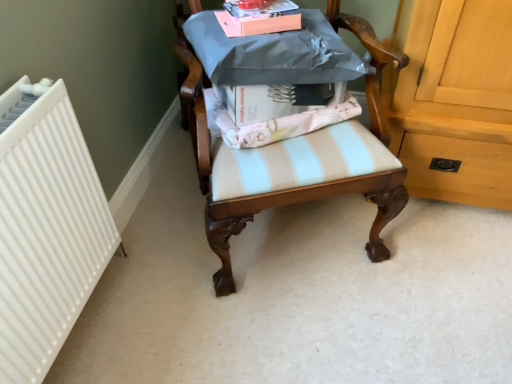
Where is `vacant area that lies to the right of white ribbed radiator at left`? vacant area that lies to the right of white ribbed radiator at left is located at coordinates (288, 251).